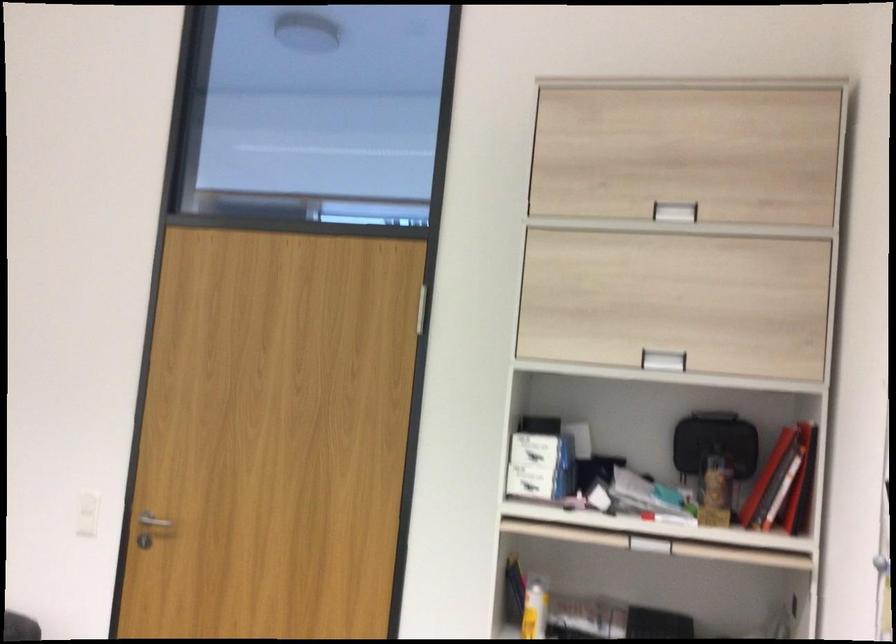
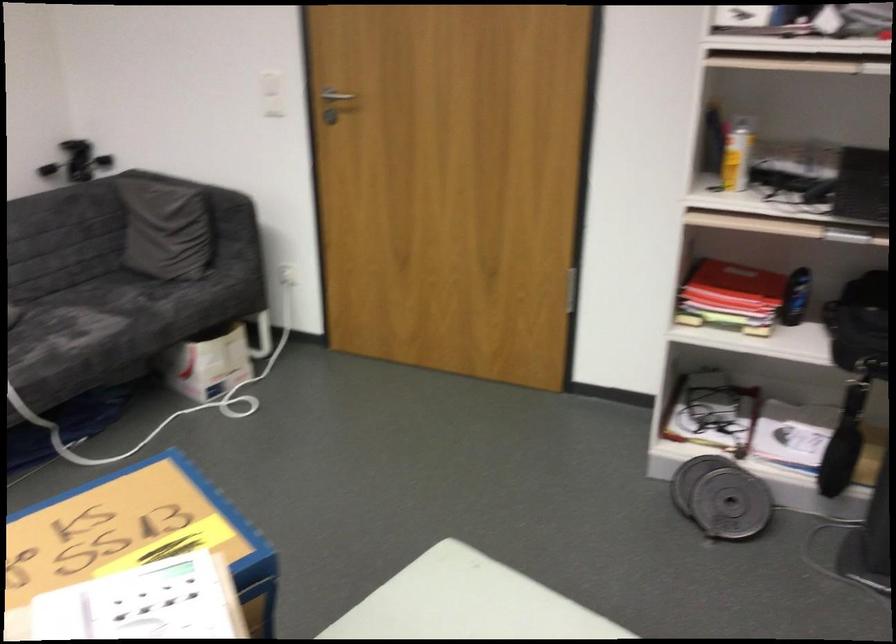
Find the pixel in the second image that matches (x=147, y=522) in the first image.

(331, 98)